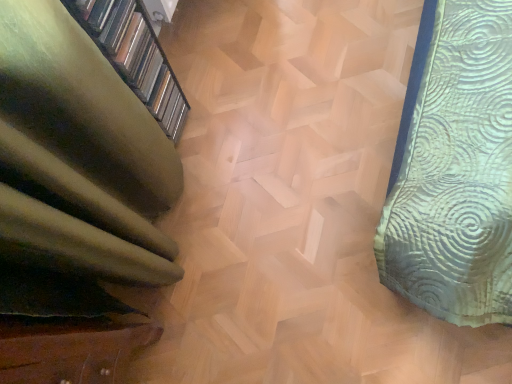
Image resolution: width=512 pixels, height=384 pixels. What are the coordinates of `green fabric at left` in the screenshot? It's located at (135, 56).

Describe the element at coordinates (135, 56) in the screenshot. I see `green fabric at left` at that location.

Locate an element on the screen. This screenshot has height=384, width=512. wooden staircase at center is located at coordinates (284, 189).

The image size is (512, 384). Describe the element at coordinates (284, 189) in the screenshot. I see `wooden staircase at center` at that location.

At what (x,y) coordinates should I click in order to perform the action: click on green fabric at left. Please return your answer as a coordinate pair (x, y). The width and height of the screenshot is (512, 384). Looking at the image, I should click on (135, 56).

Can you confirm if wooden staircase at center is positioned to the right of green fabric at left?

Yes.

Looking at this image, considering the relative positions of wooden staircase at center and green fabric at left in the image provided, is wooden staircase at center in front of green fabric at left?

No, the depth of wooden staircase at center is greater than that of green fabric at left.

Does point (289, 9) lie behind point (72, 9)?

That is True.

From the image's perspective, relative to green fabric at left, is wooden staircase at center above or below?

Based on their image positions, wooden staircase at center is located beneath green fabric at left.

From a real-world perspective, which is physically above, wooden staircase at center or green fabric at left?

green fabric at left, from a real-world perspective.

Does wooden staircase at center have a lesser width compared to green fabric at left?

No.

Which of these two, wooden staircase at center or green fabric at left, stands taller?

green fabric at left.

Looking at the image, does wooden staircase at center seem bigger or smaller compared to green fabric at left?

wooden staircase at center is bigger than green fabric at left.

Is green fabric at left located within wooden staircase at center?

No, wooden staircase at center does not contain green fabric at left.

Can you see wooden staircase at center touching green fabric at left?

They are not placed beside each other.

Is wooden staircase at center oriented away from green fabric at left?

No, wooden staircase at center's orientation is not away from green fabric at left.

Measure the distance between wooden staircase at center and green fabric at left.

wooden staircase at center and green fabric at left are 42.12 centimeters apart.

You are a GUI agent. You are given a task and a screenshot of the screen. Output one action in this format:
    pyautogui.click(x=<x>, y=<y>)
    Task: Click on the shelf above the wooden staircase at center (from a real-world perspective)
    This screenshot has width=512, height=384.
    Given the screenshot: What is the action you would take?
    pyautogui.click(x=135, y=56)

Which is more to the left, green fabric at left or wooden staircase at center?

green fabric at left is more to the left.

Is green fabric at left closer to camera compared to wooden staircase at center?

That is True.

Is point (132, 14) closer or farther from the camera than point (298, 12)?

Point (132, 14) is closer to the camera than point (298, 12).

From the image's perspective, between green fabric at left and wooden staircase at center, which one is located above?

green fabric at left, from the image's perspective.

From a real-world perspective, between green fabric at left and wooden staircase at center, who is vertically higher?

green fabric at left is physically above.

Considering the sizes of objects green fabric at left and wooden staircase at center in the image provided, who is wider, green fabric at left or wooden staircase at center?

wooden staircase at center is wider.

Considering the sizes of objects green fabric at left and wooden staircase at center in the image provided, who is taller, green fabric at left or wooden staircase at center?

green fabric at left.

Based on their sizes in the image, would you say green fabric at left is bigger or smaller than wooden staircase at center?

green fabric at left is smaller than wooden staircase at center.

Is wooden staircase at center located within green fabric at left?

No, wooden staircase at center is located outside of green fabric at left.

Would you say green fabric at left is a long distance from wooden staircase at center?

No, there isn't a large distance between green fabric at left and wooden staircase at center.

Is green fabric at left turned away from wooden staircase at center?

No, wooden staircase at center is not at the back of green fabric at left.

What's the angular difference between green fabric at left and wooden staircase at center's facing directions?

The angular difference between green fabric at left and wooden staircase at center is 179 degrees.

Measure the distance from green fabric at left to wooden staircase at center.

16.58 inches.

Where is `stairwell below the green fabric at left (from the image's perspective)`? stairwell below the green fabric at left (from the image's perspective) is located at coordinates (284, 189).

Locate an element on the screen. The image size is (512, 384). shelf above the wooden staircase at center (from a real-world perspective) is located at coordinates (135, 56).

Locate an element on the screen. The image size is (512, 384). stairwell located behind the green fabric at left is located at coordinates (284, 189).